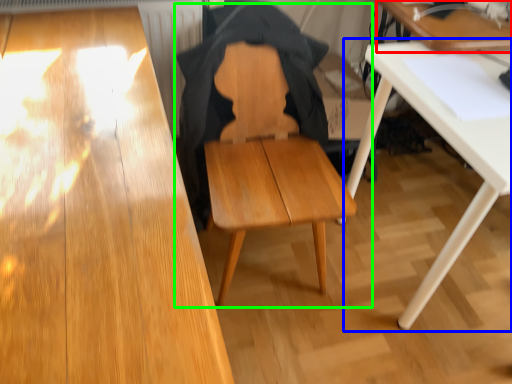
Question: Which is nearer to the table (highlighted by a red box)? table (highlighted by a blue box) or chair (highlighted by a green box).

Choices:
 (A) table
 (B) chair

Answer: (A)